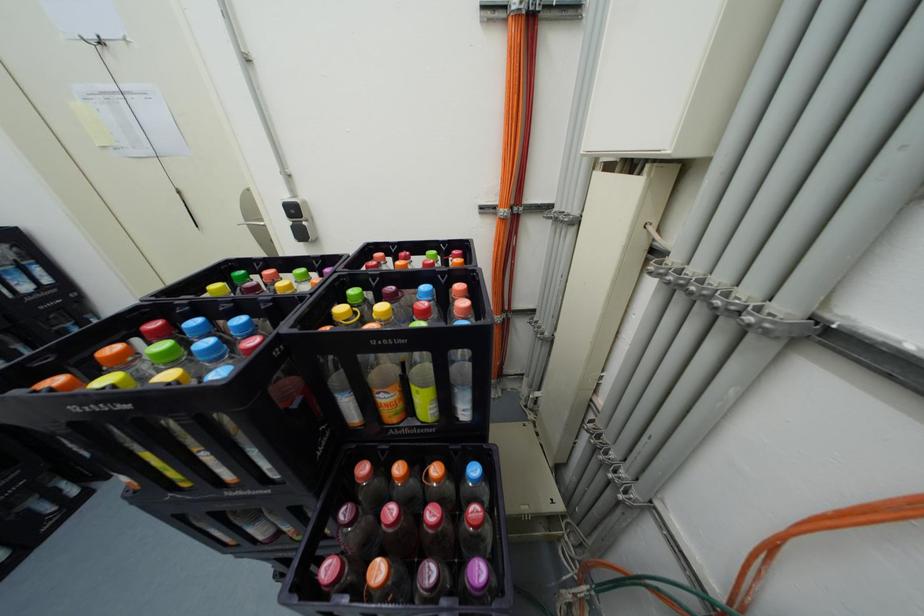
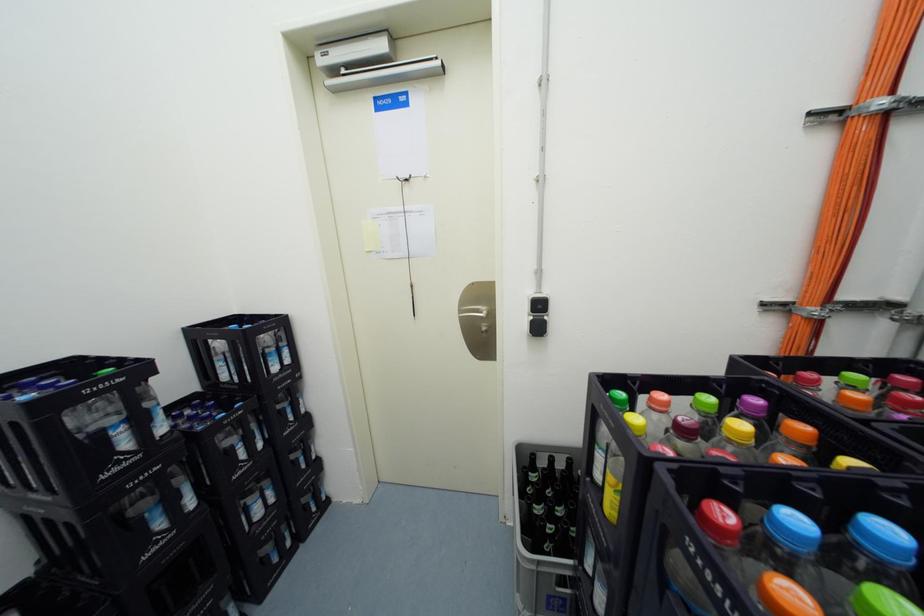
Question: The images are taken continuously from a first-person perspective. In which direction are you moving?

Choices:
 (A) Left
 (B) Right
 (C) Forward
 (D) Backward

Answer: (A)